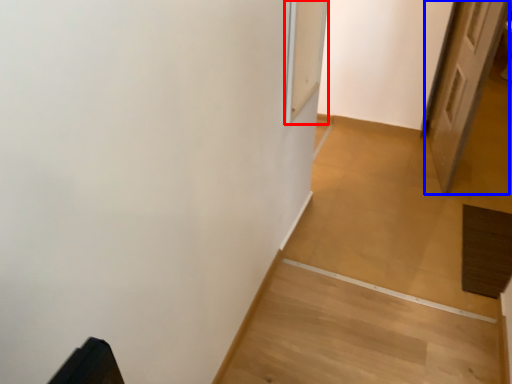
Question: Which object is further to the camera taking this photo, screen door (highlighted by a red box) or door (highlighted by a blue box)?

Choices:
 (A) screen door
 (B) door

Answer: (B)